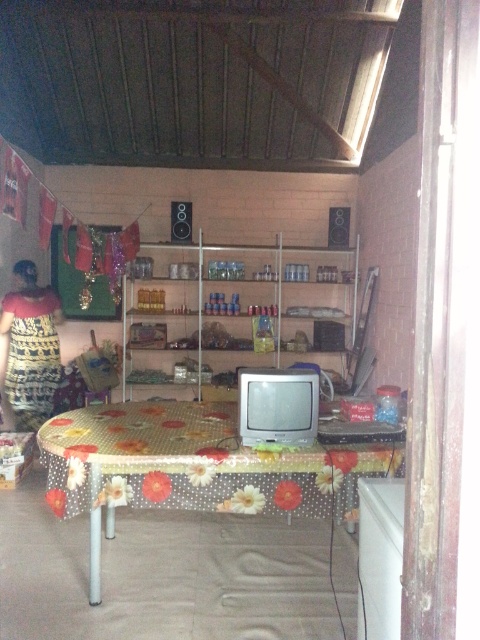
Does floral-patterned fabric table at center appear on the right side of metallic shelves at center?

No, floral-patterned fabric table at center is not to the right of metallic shelves at center.

Does floral-patterned fabric table at center lie behind metallic shelves at center?

No, floral-patterned fabric table at center is in front of metallic shelves at center.

Is point (370, 472) positioned behind point (132, 296)?

No, it is not.

The width and height of the screenshot is (480, 640). I want to click on floral-patterned fabric table at center, so click(194, 467).